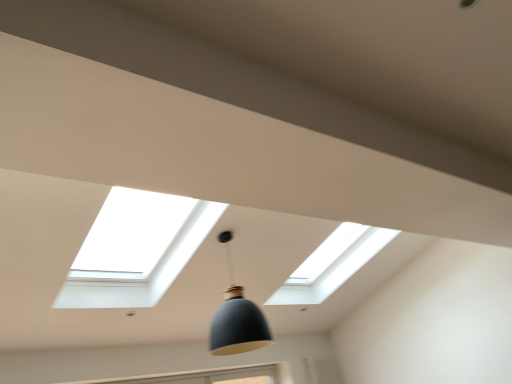
This screenshot has height=384, width=512. What do you see at coordinates (237, 318) in the screenshot? I see `matte black pendant light at center` at bounding box center [237, 318].

At what (x,y) coordinates should I click in order to perform the action: click on matte black pendant light at center. Please return your answer as a coordinate pair (x, y). The height and width of the screenshot is (384, 512). Looking at the image, I should click on (237, 318).

Where is `matte black pendant light at center`? This screenshot has width=512, height=384. matte black pendant light at center is located at coordinates (237, 318).